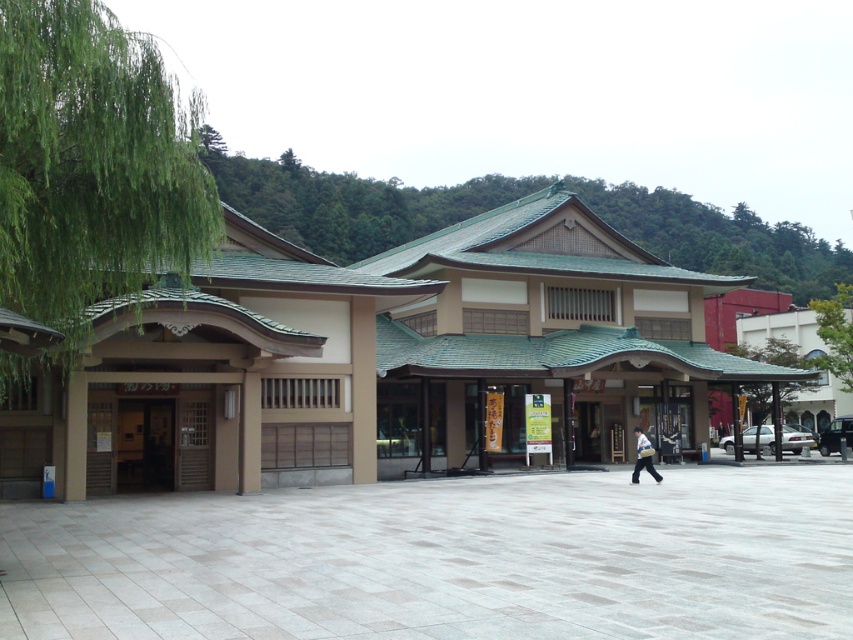
Which is above, light gray stone plaza at center or light blue fabric bag at center?

light blue fabric bag at center is above.

Between light gray stone plaza at center and light blue fabric bag at center, which one has more height?

light gray stone plaza at center is taller.

Find the location of `light gray stone plaza at center`. light gray stone plaza at center is located at coordinates (445, 560).

Is beige wooden mall at center thinner than light blue fabric bag at center?

No, beige wooden mall at center is not thinner than light blue fabric bag at center.

Is point (120, 416) farther from camera compared to point (634, 472)?

Yes, it is.

Which is in front, point (595, 300) or point (640, 467)?

Point (640, 467)

Find the location of a particular element. beige wooden mall at center is located at coordinates (378, 358).

Which is more to the left, green leafy tree at right or light blue fabric bag at center?

From the viewer's perspective, light blue fabric bag at center appears more on the left side.

Which is in front, point (834, 337) or point (639, 465)?

Point (639, 465) is more forward.

Identify the location of green leafy tree at right. The height and width of the screenshot is (640, 853). tap(834, 333).